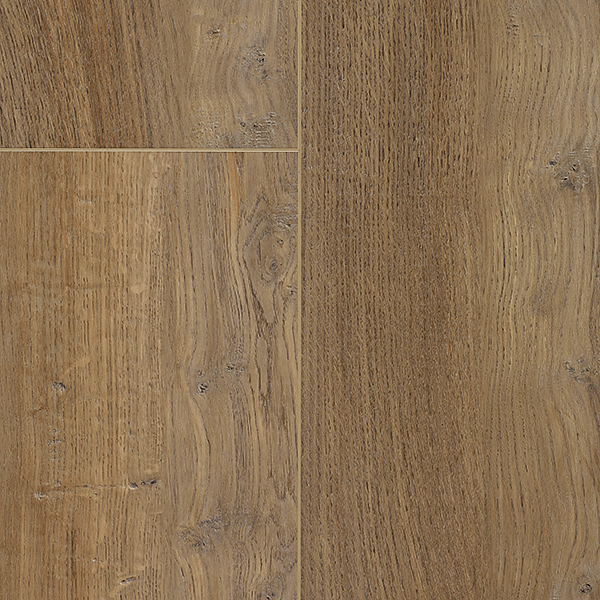
Identify the location of wooden panel. (115, 228), (501, 229), (155, 92).